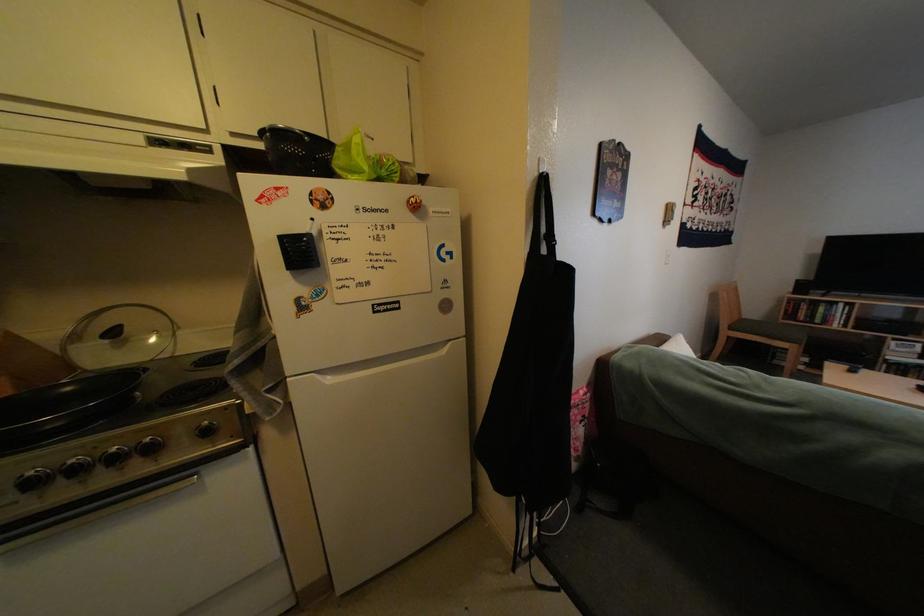
This screenshot has height=616, width=924. Describe the element at coordinates (779, 331) in the screenshot. I see `the chair sitting surface` at that location.